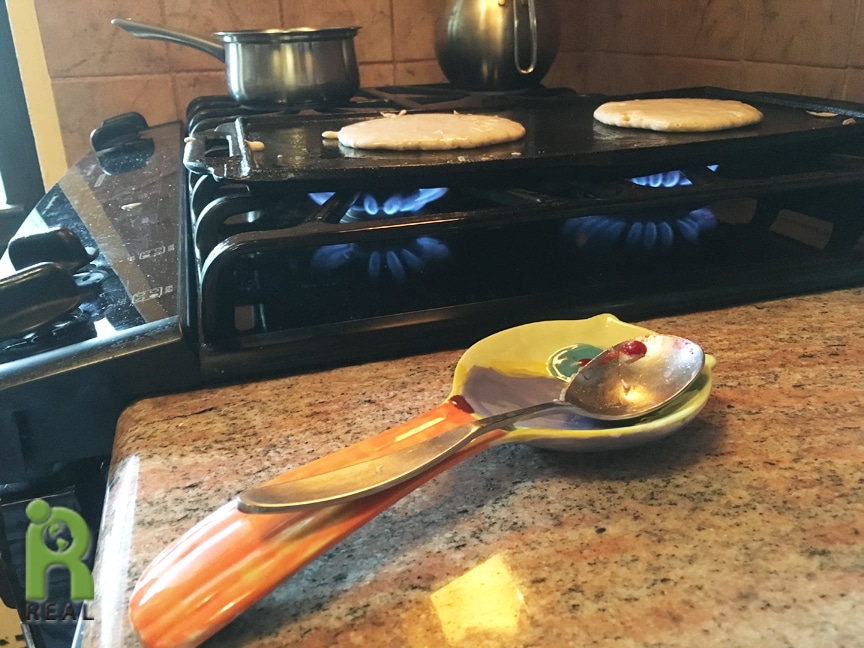
The image size is (864, 648). In order to click on stove grates in this screenshot , I will do `click(305, 238)`.